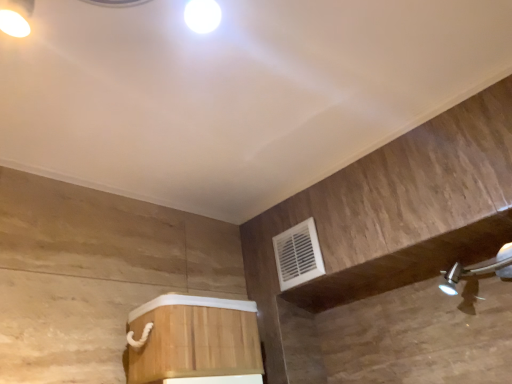
This screenshot has height=384, width=512. Describe the element at coordinates (298, 255) in the screenshot. I see `white plastic vent at lower right` at that location.

Image resolution: width=512 pixels, height=384 pixels. I want to click on white plastic vent at lower right, so click(298, 255).

Locate an element on the screen. white plastic vent at lower right is located at coordinates (298, 255).